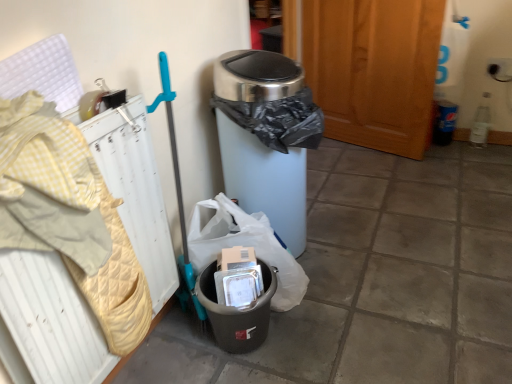
Question: Does point (257, 107) appear closer or farther from the camera than point (68, 112)?

Choices:
 (A) farther
 (B) closer

Answer: (A)

Question: In terms of height, does stainless steel trash can at center, the first waste container in the top-to-bottom sequence, look taller or shorter compared to yellow quilted radiator at left?

Choices:
 (A) short
 (B) tall

Answer: (B)

Question: Which object is the farthest from the yellow quilted radiator at left?

Choices:
 (A) wooden screen door at center
 (B) black plastic trash can at lower center
 (C) matte gray trash can at lower left, which is counted as the second waste container, starting from the top
 (D) stainless steel trash can at center, the first waste container in the top-to-bottom sequence

Answer: (A)

Question: Estimate the real-world distances between objects in this image. Which object is farther from the matte gray trash can at lower left, arranged as the first waste container when ordered from the bottom?

Choices:
 (A) black plastic trash can at lower center
 (B) wooden screen door at center
 (C) yellow quilted radiator at left
 (D) stainless steel trash can at center, which is counted as the 2th waste container, starting from the bottom

Answer: (B)